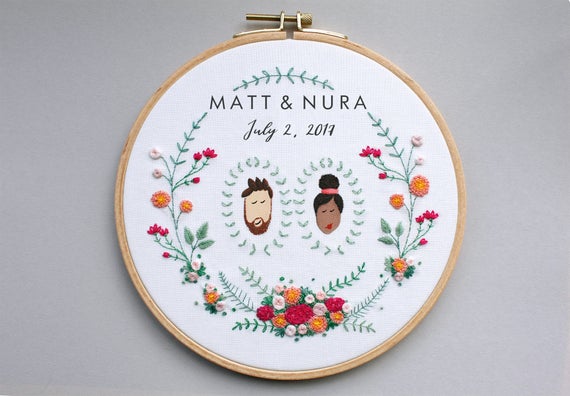
Locate an element on the screen. This screenshot has height=396, width=570. artwork is located at coordinates (397, 120).